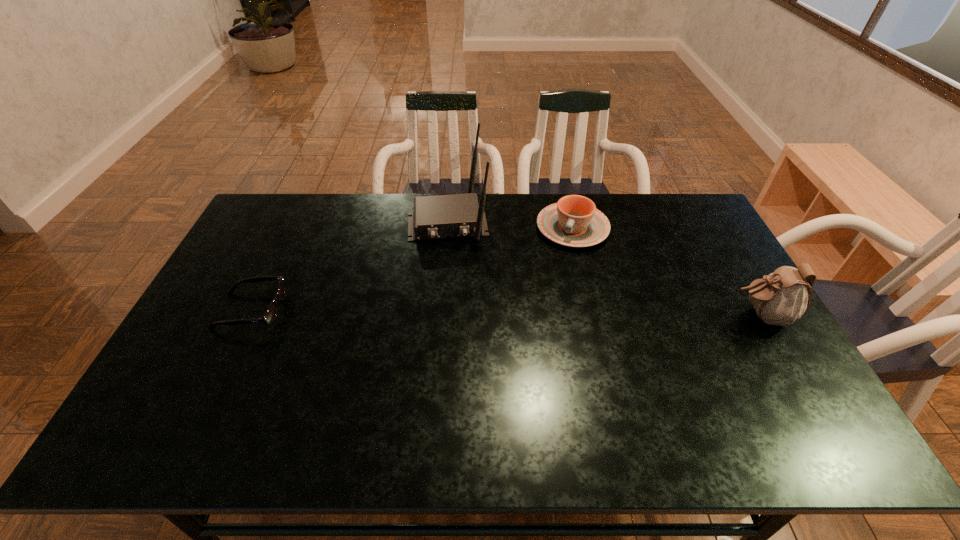
The image size is (960, 540). Identify the location of spectacles. (269, 316).

The width and height of the screenshot is (960, 540). Identify the location of the leftmost object. 269,316.

What are the coordinates of `pouch` in the screenshot? It's located at (780, 298).

Identify the location of the rightmost object. Image resolution: width=960 pixels, height=540 pixels. (780, 298).

Find the location of a particular element. the tallest object is located at coordinates (435, 217).

Find the location of a particular element. This screenshot has width=960, height=540. the second object from left to right is located at coordinates (435, 217).

Identify the location of the third tallest object. (574, 221).

Find the location of a particular element. chinaware is located at coordinates (574, 221).

The width and height of the screenshot is (960, 540). What are the coordinates of `vacant region located on the lenses of the shortest object` in the screenshot? It's located at (324, 311).

At what (x,y) coordinates should I click in order to perform the action: click on vacant region located on the front-facing side of the rightmost object. Please return your answer as a coordinate pair (x, y). The width and height of the screenshot is (960, 540). Looking at the image, I should click on (596, 315).